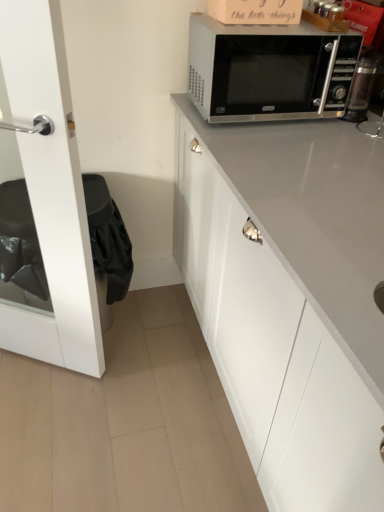
Question: From the image's perspective, is white glossy door at left under satin silver microwave at upper right?

Choices:
 (A) no
 (B) yes

Answer: (B)

Question: Does white glossy door at left have a smaller size compared to satin silver microwave at upper right?

Choices:
 (A) yes
 (B) no

Answer: (B)

Question: Are white glossy door at left and satin silver microwave at upper right far apart?

Choices:
 (A) yes
 (B) no

Answer: (B)

Question: Is white glossy door at left positioned with its back to satin silver microwave at upper right?

Choices:
 (A) yes
 (B) no

Answer: (B)

Question: Is white glossy door at left at the left side of satin silver microwave at upper right?

Choices:
 (A) no
 (B) yes

Answer: (B)

Question: Does white glossy door at left have a lesser height compared to satin silver microwave at upper right?

Choices:
 (A) yes
 (B) no

Answer: (B)

Question: Considering the relative sizes of satin silver microwave at upper right and white glossy door at left in the image provided, is satin silver microwave at upper right shorter than white glossy door at left?

Choices:
 (A) yes
 (B) no

Answer: (A)

Question: Is white glossy door at left at the back of satin silver microwave at upper right?

Choices:
 (A) no
 (B) yes

Answer: (A)

Question: Is satin silver microwave at upper right not near white glossy door at left?

Choices:
 (A) no
 (B) yes

Answer: (A)

Question: Are satin silver microwave at upper right and white glossy door at left making contact?

Choices:
 (A) yes
 (B) no

Answer: (B)

Question: Does satin silver microwave at upper right have a lesser width compared to white glossy door at left?

Choices:
 (A) yes
 (B) no

Answer: (B)

Question: From the image's perspective, is satin silver microwave at upper right on white glossy door at left?

Choices:
 (A) yes
 (B) no

Answer: (A)

Question: From the image's perspective, is satin silver microwave at upper right positioned above or below white glossy door at left?

Choices:
 (A) below
 (B) above

Answer: (B)